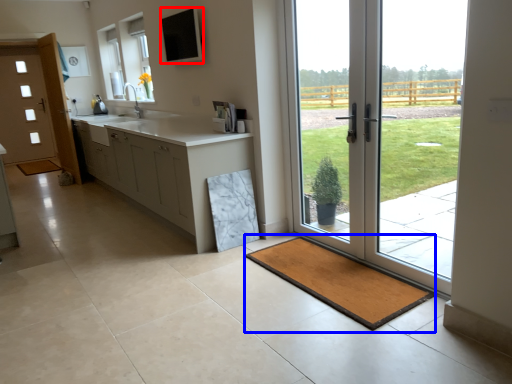
Question: Among these objects, which one is farthest to the camera, window screen (highlighted by a red box) or bath mat (highlighted by a blue box)?

Choices:
 (A) window screen
 (B) bath mat

Answer: (A)